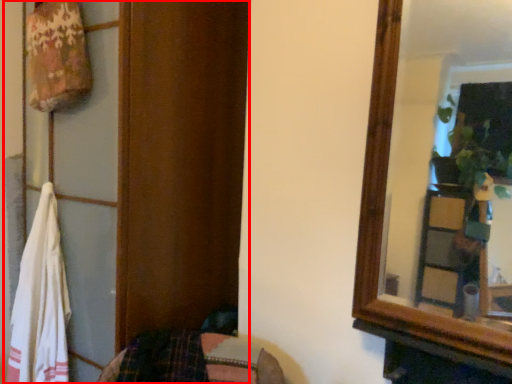
Question: Where is dresser (annotated by the red box) located in relation to beach towel in the image?

Choices:
 (A) right
 (B) left

Answer: (A)